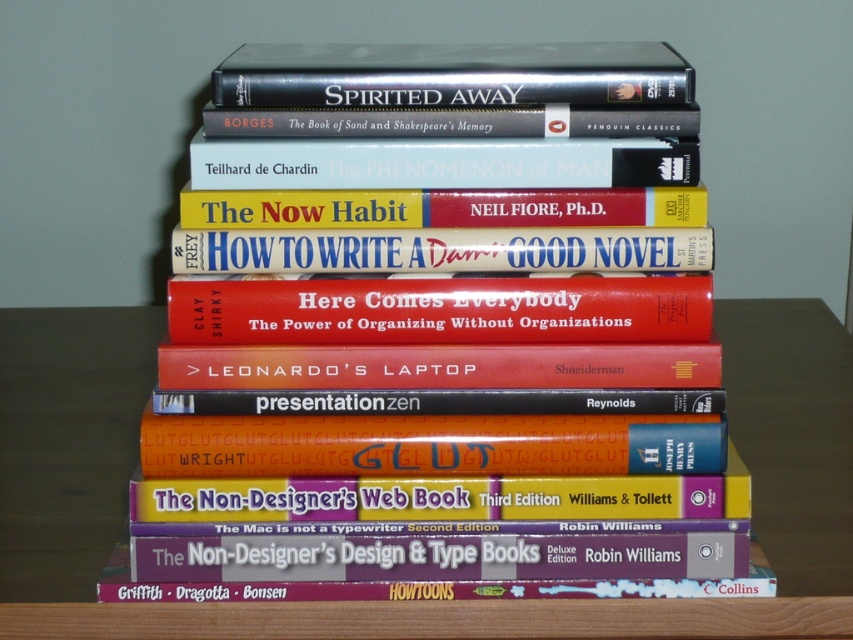
Is point (54, 356) less distant than point (340, 148)?

No, (54, 356) is behind (340, 148).

Does point (851, 365) come behind point (457, 170)?

That is True.

At what (x,y) coordinates should I click in order to perform the action: click on wooden table at center. Please return your answer as a coordinate pair (x, y). Looking at the image, I should click on (407, 602).

Does red matte book at center have a greater height compared to metallic silver dvd at upper center?

No, red matte book at center is not taller than metallic silver dvd at upper center.

Which is behind, point (447, 300) or point (254, 77)?

Positioned behind is point (447, 300).

You are a GUI agent. You are given a task and a screenshot of the screen. Output one action in this format:
    pyautogui.click(x=<x>, y=<y>)
    Task: Click on the red matte book at center
    
    Given the screenshot: What is the action you would take?
    pyautogui.click(x=439, y=308)

Does metallic silver dvd at upper center have a greater height compared to white paper book at center?

Yes.

Between metallic silver dvd at upper center and white paper book at center, which one appears on the left side from the viewer's perspective?

white paper book at center is more to the left.

Does point (444, 54) lie behind point (619, 170)?

Yes, it is behind point (619, 170).

This screenshot has width=853, height=640. I want to click on metallic silver dvd at upper center, so click(x=451, y=76).